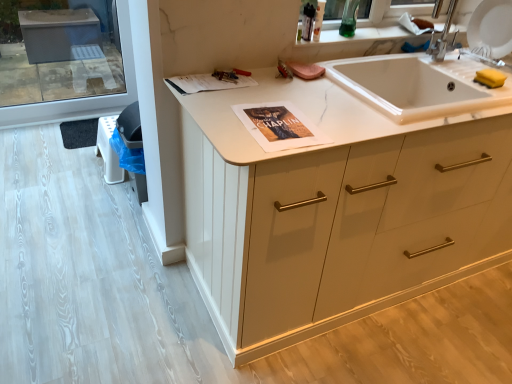
Locate an element on the screen. vacant space in front of matte paper magazine at upper center is located at coordinates (211, 101).